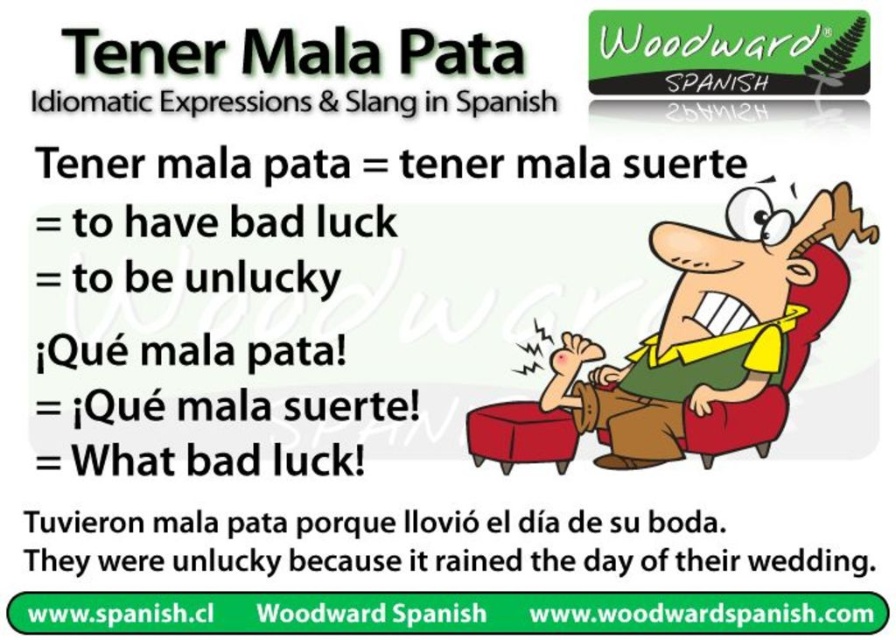
Question: Which of the following is the closest to the observer?

Choices:
 (A) white paper text at center
 (B) green fabric shirt at upper right
 (C) green metallic text at upper center
 (D) white paper at upper center

Answer: (A)

Question: Considering the real-world distances, which object is farthest from the white paper text at center?

Choices:
 (A) white paper at upper center
 (B) green fabric shirt at upper right

Answer: (A)

Question: Does green metallic text at upper center have a lesser width compared to white paper at upper center?

Choices:
 (A) yes
 (B) no

Answer: (A)

Question: Can you confirm if green fabric shirt at upper right is positioned to the right of white paper at upper center?

Choices:
 (A) yes
 (B) no

Answer: (A)

Question: Which point is closer to the camera?

Choices:
 (A) green fabric shirt at upper right
 (B) green metallic text at upper center

Answer: (B)

Question: Can you confirm if white paper text at center is positioned above white paper at upper center?

Choices:
 (A) no
 (B) yes

Answer: (A)